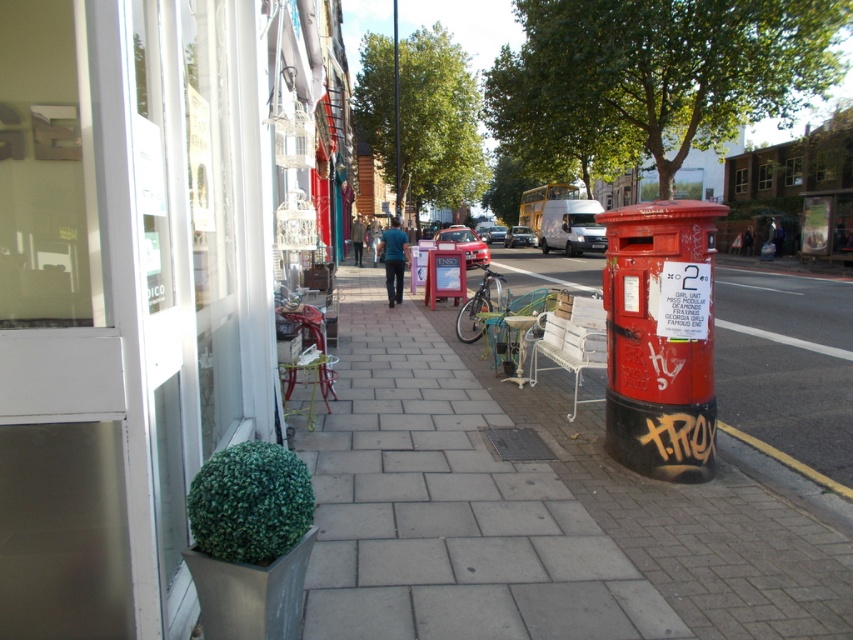
Question: Which point appears farthest from the camera in this image?

Choices:
 (A) click(x=173, y=131)
 (B) click(x=817, y=513)

Answer: (B)

Question: Can you confirm if green matte plant at lower left is positioned below yellow rubber at lower right?

Choices:
 (A) yes
 (B) no

Answer: (B)

Question: Does green matte plant at lower left have a larger size compared to yellow rubber at lower right?

Choices:
 (A) no
 (B) yes

Answer: (B)

Question: Which object appears closest to the camera in this image?

Choices:
 (A) green matte plant at lower left
 (B) yellow rubber at lower right

Answer: (A)

Question: Does green matte plant at lower left appear under yellow rubber at lower right?

Choices:
 (A) no
 (B) yes

Answer: (A)